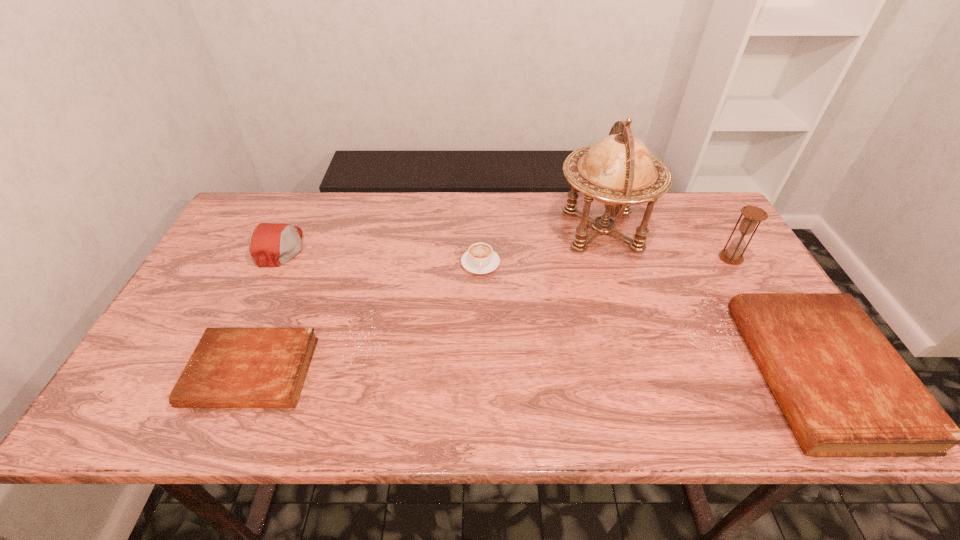
Where is `the shorter Bible`? the shorter Bible is located at coordinates (230, 367).

Find the location of a particular element. This screenshot has height=540, width=960. the fourth tallest object is located at coordinates (845, 391).

Identify the location of the taller Bible. The width and height of the screenshot is (960, 540). (845, 391).

Where is `the tallest object`? The height and width of the screenshot is (540, 960). the tallest object is located at coordinates (619, 170).

Image resolution: width=960 pixels, height=540 pixels. Find the location of `globe`. globe is located at coordinates (619, 170).

Identify the location of the fifth shortest object. This screenshot has width=960, height=540. pyautogui.click(x=752, y=215).

This screenshot has width=960, height=540. In order to click on the third tallest object in this screenshot , I will do `click(270, 244)`.

What are the coordinates of `cappuccino` in the screenshot? It's located at (480, 258).

Identify the location of free space located 0.380m on the spine side of the third shortest object. (588, 374).

Locate an element on the screen. vacant region located 0.280m on the spine side of the third shortest object is located at coordinates (633, 374).